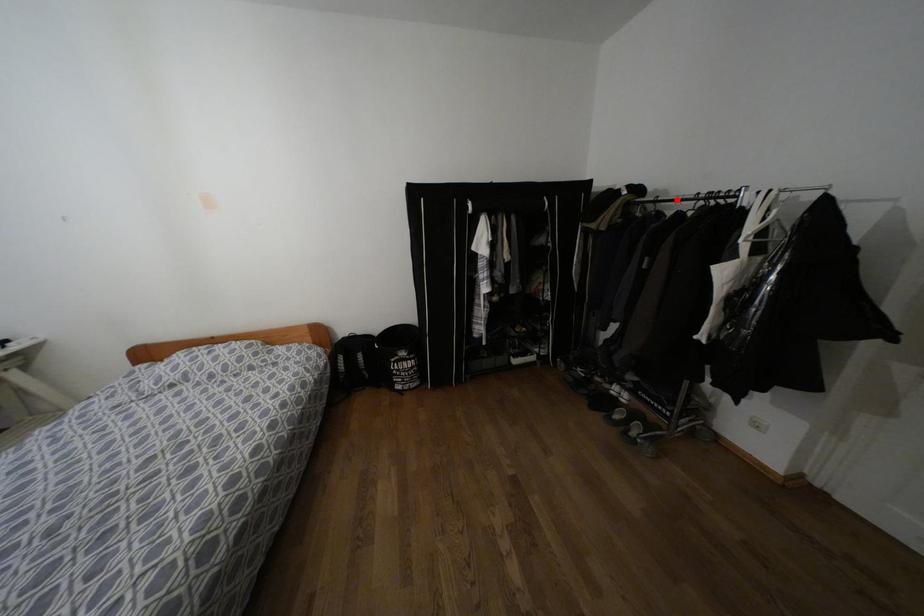
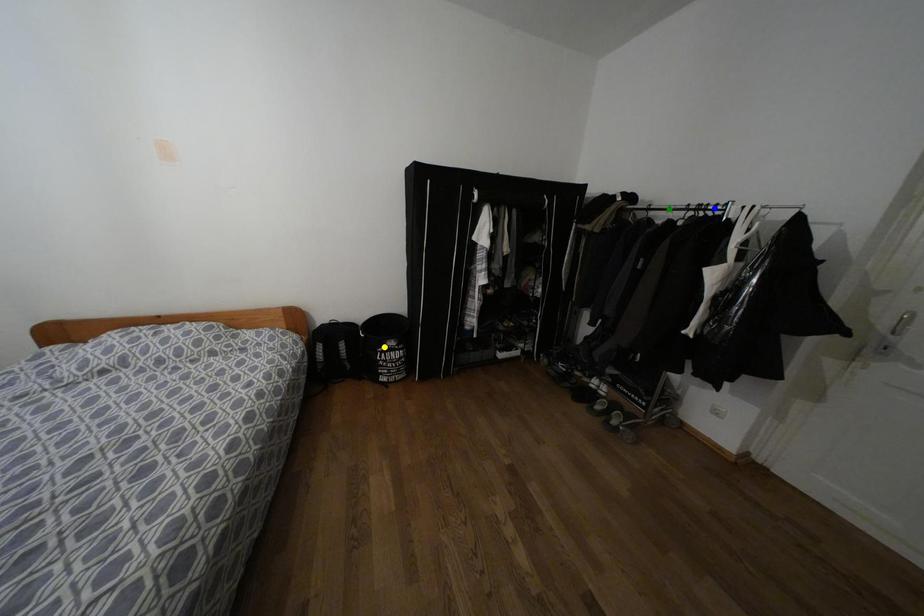
Question: I am providing you with two images of the same scene from different viewpoints. A red point is marked on the first image. You are given multiple points on the second image. Which mark in image 2 goes with the point in image 1?

Choices:
 (A) green point
 (B) blue point
 (C) yellow point

Answer: (A)